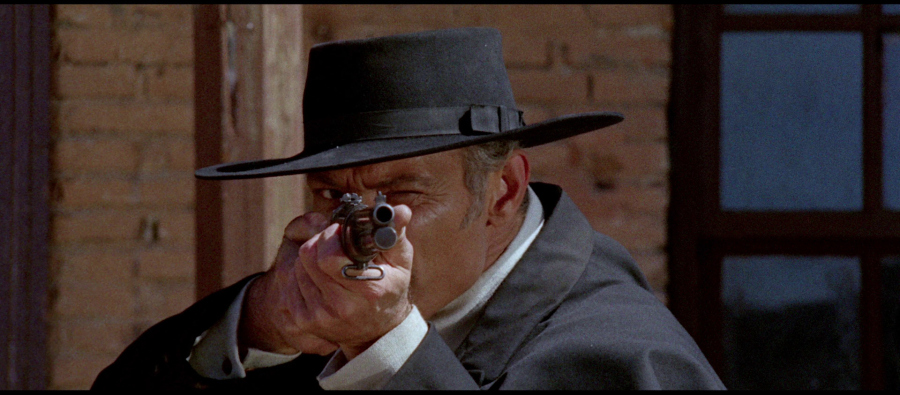
What are the coordinates of `brick wall` in the screenshot? It's located at (124, 123), (556, 81).